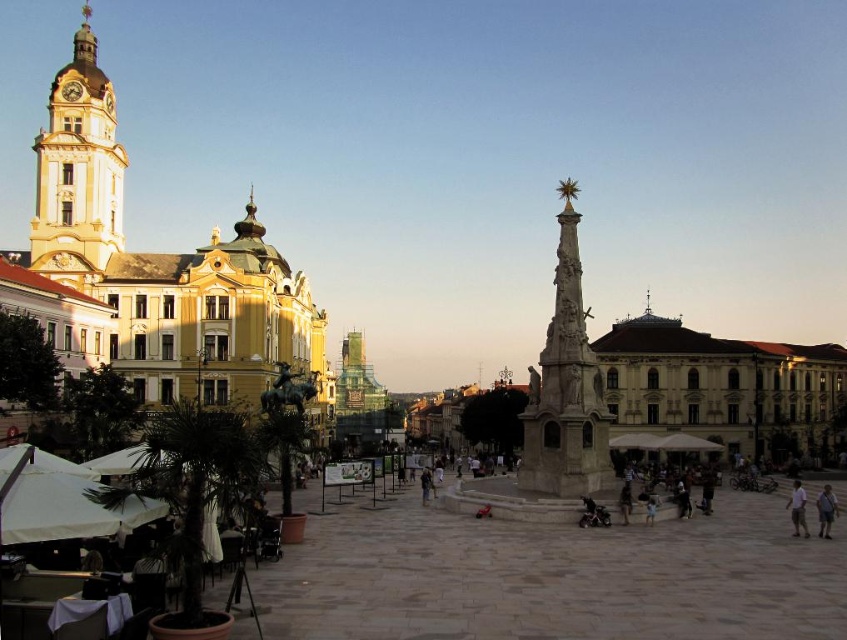
Based on the photo, you are standing in the urban square and want to take a photo of the polished stone monument at center without any people in the frame. Since the light blue shirt at center is currently blocking your view, where should you position yourself relative to the monument to avoid the person?

The polished stone monument at center is located above the light blue shirt at center, so you should position yourself behind the monument to avoid the person blocking your view.